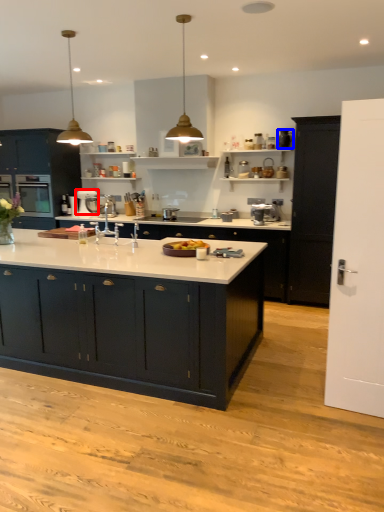
Question: Which object is further to the camera taking this photo, appliance (highlighted by a red box) or appliance (highlighted by a blue box)?

Choices:
 (A) appliance
 (B) appliance

Answer: (A)